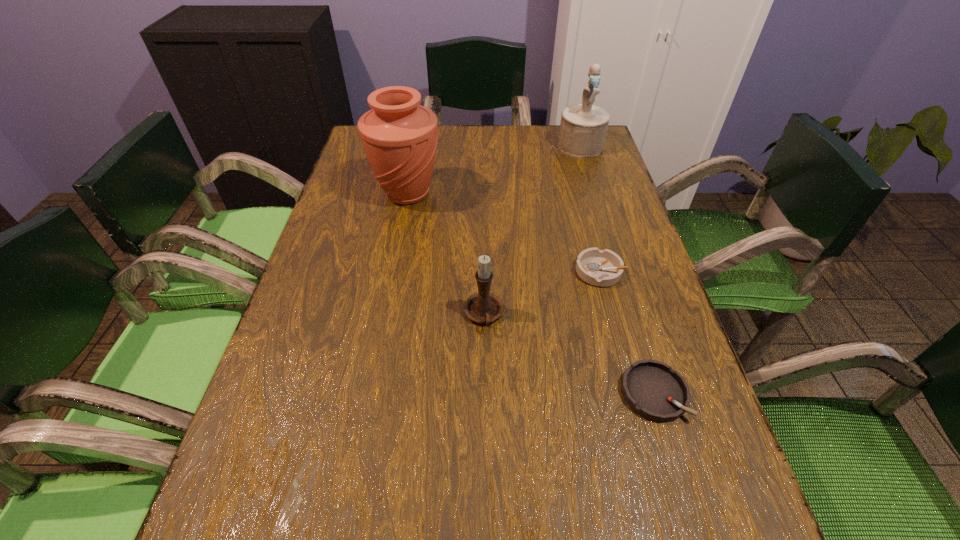
Identify the location of vacant position in the image that satisfies the following two spatial constraints: 1. on the front side of the farther ashtray; 2. on the right side of the nearest object. (632, 393).

You are a GUI agent. You are given a task and a screenshot of the screen. Output one action in this format:
    pyautogui.click(x=<x>, y=<y>)
    Task: Click on the free location that satisfies the following two spatial constraints: 1. on the side of the nearest object with the handle; 2. on the right side of the second nearest object
    
    Given the screenshot: What is the action you would take?
    pyautogui.click(x=485, y=393)